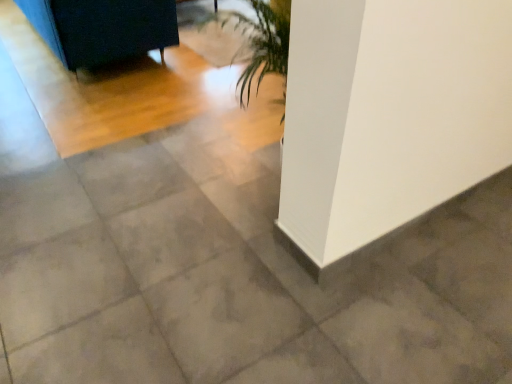
I want to click on matte black chair at left, so click(102, 28).

The height and width of the screenshot is (384, 512). What do you see at coordinates (102, 28) in the screenshot? I see `matte black chair at left` at bounding box center [102, 28].

The width and height of the screenshot is (512, 384). What are the coordinates of `matte black chair at left` in the screenshot? It's located at (102, 28).